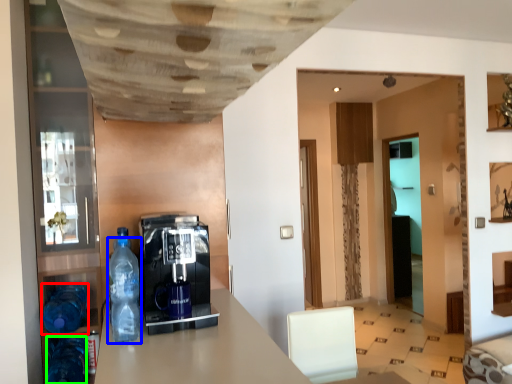
Question: Which is nearer to the bottle (highlighted by a red box)? bottle (highlighted by a blue box) or bottle (highlighted by a green box).

Choices:
 (A) bottle
 (B) bottle

Answer: (B)